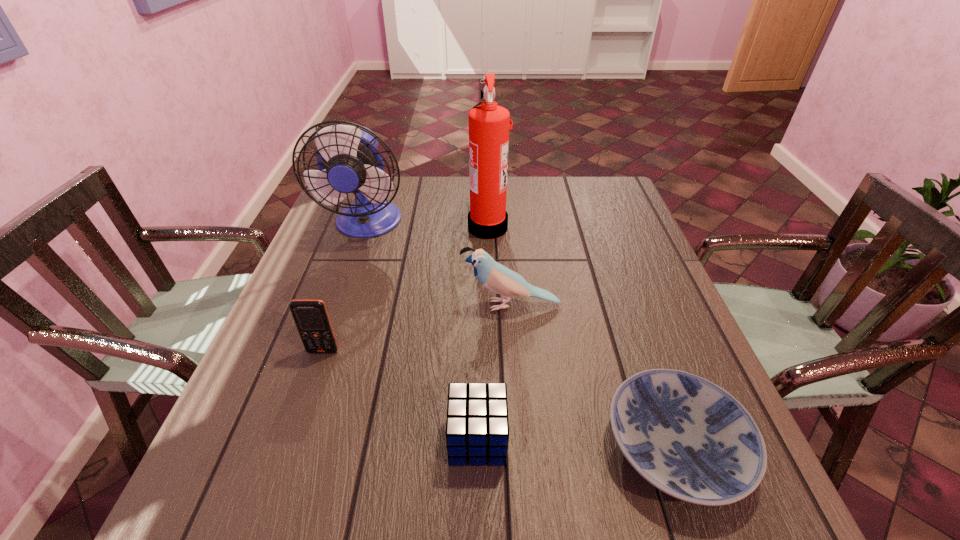
Locate an element on the screen. vacant region at the far right corner of the desktop is located at coordinates (596, 192).

What are the coordinates of `vacant region at the near right corner of the desktop` in the screenshot? It's located at (718, 514).

This screenshot has width=960, height=540. I want to click on unoccupied position between the cellular telephone and the fourth nearest object, so click(417, 328).

Locate an element on the screen. Image resolution: width=960 pixels, height=540 pixels. free space between the bird and the second shortest object is located at coordinates (494, 372).

Identify the location of vacant area that lies between the third nearest object and the bird. (417, 328).

At what (x,y) coordinates should I click in order to perform the action: click on free point between the second shortest object and the fourth nearest object. Please return your answer as a coordinate pair (x, y). This screenshot has height=540, width=960. Looking at the image, I should click on (494, 372).

Find the location of a particular element. This screenshot has height=540, width=960. vacant area between the rightmost object and the fifth tallest object is located at coordinates (576, 443).

Find the location of `free point between the rightmost object and the fire extinguisher`. free point between the rightmost object and the fire extinguisher is located at coordinates (582, 336).

The height and width of the screenshot is (540, 960). What are the coordinates of `unoccupied position between the tallest object and the fan` in the screenshot? It's located at click(427, 225).

You are a GUI agent. You are given a task and a screenshot of the screen. Output one action in this format:
    pyautogui.click(x=<x>, y=<y>)
    Task: Click on the free space between the second tallest object and the rightmost object
    
    Given the screenshot: What is the action you would take?
    pyautogui.click(x=521, y=335)